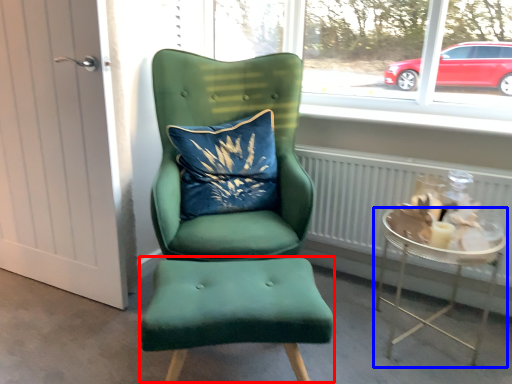
Question: Among these objects, which one is nearest to the camera, stool (highlighted by a red box) or table (highlighted by a blue box)?

Choices:
 (A) stool
 (B) table

Answer: (A)